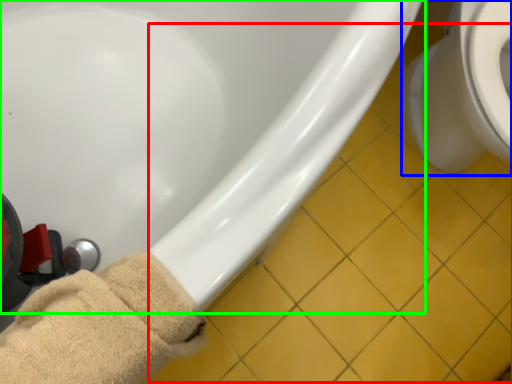
Question: Which object is the farthest from tile (highlighted by a red box)? Choose among these: toilet (highlighted by a blue box) or bathtub (highlighted by a green box).

Choices:
 (A) toilet
 (B) bathtub

Answer: (B)